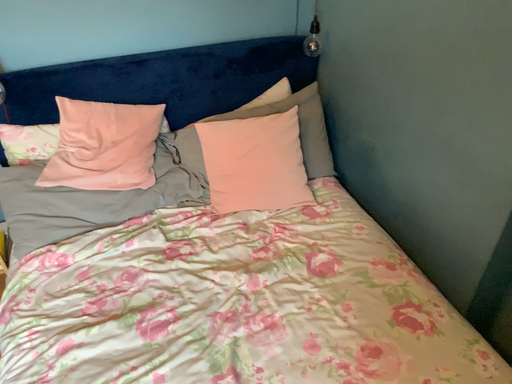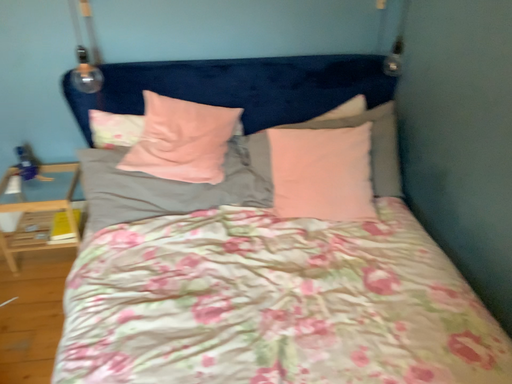
Question: How did the camera likely rotate when shooting the video?

Choices:
 (A) rotated right
 (B) rotated left

Answer: (B)